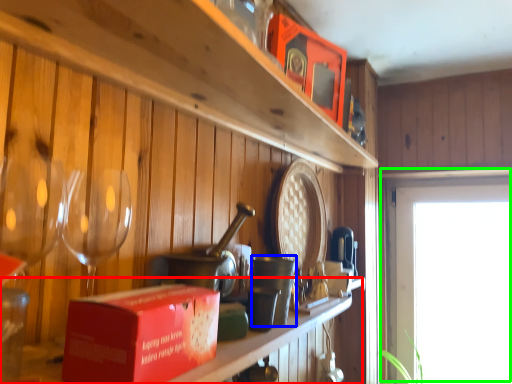
Question: Based on their relative distances, which object is farther from table (highlighted by a red box)? Choose from tableware (highlighted by a blue box) and window (highlighted by a green box).

Choices:
 (A) tableware
 (B) window

Answer: (B)